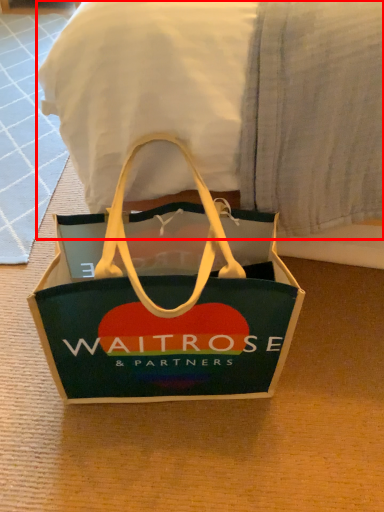
Question: Considering the relative positions of bedding (annotated by the red box) and handbag in the image provided, where is bedding (annotated by the red box) located with respect to the staircase?

Choices:
 (A) left
 (B) right

Answer: (B)